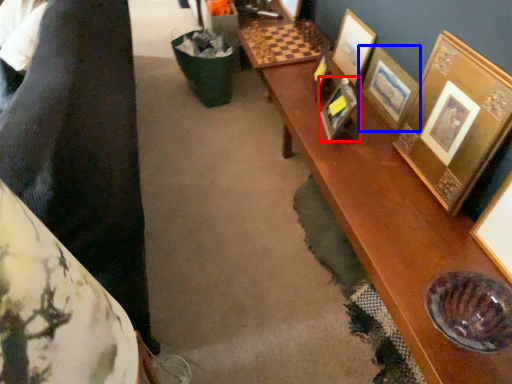
Question: Which point is closer to the camera, picture frame (highlighted by a red box) or picture frame (highlighted by a blue box)?

Choices:
 (A) picture frame
 (B) picture frame

Answer: (B)